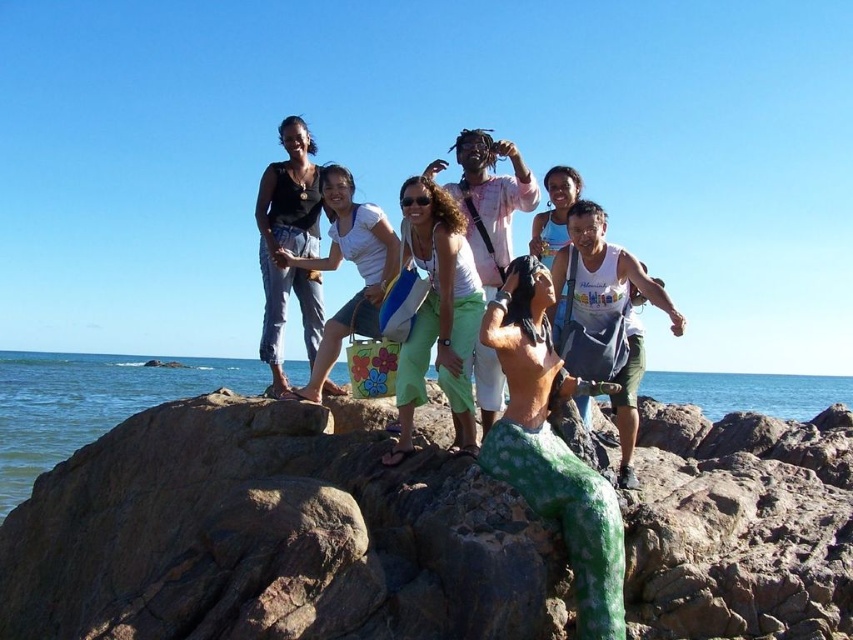
Is point (189, 385) farther from viewer compared to point (329, 184)?

Yes, it is.

In order to click on greenish-blue water at center in this screenshot , I will do `click(90, 403)`.

Is point (90, 436) behind point (380, 241)?

Yes, it is behind point (380, 241).

Where is `greenish-blue water at center`? The image size is (853, 640). greenish-blue water at center is located at coordinates (90, 403).

Is white cotton tank top at center smaller than matte black tank top at upper left?

Yes.

Does white cotton tank top at center have a lesser height compared to matte black tank top at upper left?

Yes, white cotton tank top at center is shorter than matte black tank top at upper left.

Describe the element at coordinates (437, 314) in the screenshot. I see `white cotton tank top at center` at that location.

Identify the location of white cotton tank top at center. The width and height of the screenshot is (853, 640). (437, 314).

Can you confirm if green painted rock at center is positioned below white cotton tank top at center?

Yes, green painted rock at center is below white cotton tank top at center.

Which is below, green painted rock at center or white cotton tank top at center?

green painted rock at center

Does point (254, 500) lie in front of point (407, 352)?

Yes.

This screenshot has height=640, width=853. Find the location of `green painted rock at center`. green painted rock at center is located at coordinates (271, 538).